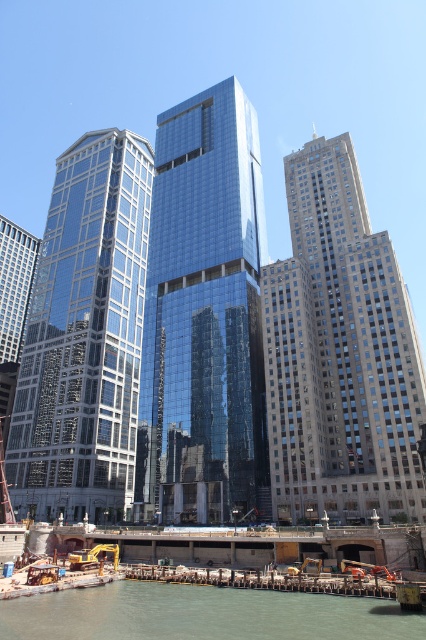
Question: Is shiny glass skyscraper at left bigger than greenish water at lower center?

Choices:
 (A) no
 (B) yes

Answer: (B)

Question: Which object is positioned closest to the shiny glass skyscraper at left?

Choices:
 (A) greenish water at lower center
 (B) gray stone skyscraper at right
 (C) glossy glass skyscraper at center

Answer: (C)

Question: Is gray stone skyscraper at right below glossy glass skyscraper at center?

Choices:
 (A) yes
 (B) no

Answer: (A)

Question: Estimate the real-world distances between objects in this image. Which object is closer to the glossy glass skyscraper at center?

Choices:
 (A) gray stone skyscraper at right
 (B) greenish water at lower center

Answer: (A)

Question: Which of the following is the closest to the observer?

Choices:
 (A) gray stone skyscraper at right
 (B) shiny glass skyscraper at left

Answer: (A)

Question: Where is gray stone skyscraper at right located in relation to glossy glass skyscraper at center in the image?

Choices:
 (A) left
 (B) right

Answer: (B)